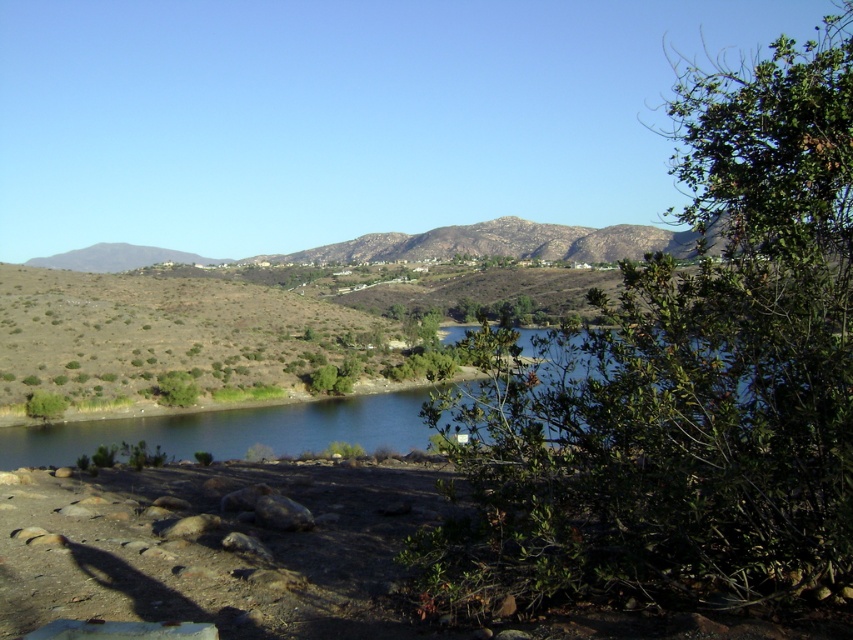
Question: Is clear blue water at center bigger than green leafy bush at lower left?

Choices:
 (A) no
 (B) yes

Answer: (B)

Question: Which of the following is the farthest from the observer?

Choices:
 (A) green leafy bush at lower left
 (B) green leafy bush at right
 (C) clear blue water at center
 (D) green leafy tree at lower left

Answer: (D)

Question: Is clear blue water at center wider than green leafy bush at lower left?

Choices:
 (A) no
 (B) yes

Answer: (B)

Question: Which point appears farthest from the camera in this image?

Choices:
 (A) (56, 413)
 (B) (503, 477)

Answer: (A)

Question: Can you confirm if clear blue water at center is positioned to the right of green leafy bush at lower left?

Choices:
 (A) no
 (B) yes

Answer: (B)

Question: Among these points, which one is nearest to the camera?

Choices:
 (A) (190, 376)
 (B) (614, 410)

Answer: (B)